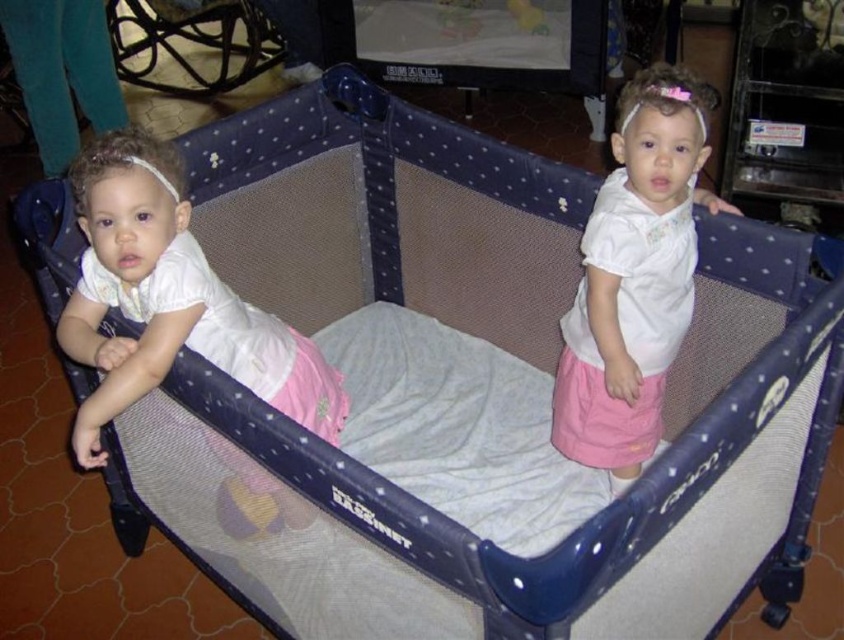
Question: Among these points, which one is farthest from the camera?

Choices:
 (A) (639, 102)
 (B) (122, 236)

Answer: (A)

Question: Does matte white dress at left appear under white matte shirt at upper center?

Choices:
 (A) yes
 (B) no

Answer: (A)

Question: Does matte white dress at left appear over white matte shirt at upper center?

Choices:
 (A) yes
 (B) no

Answer: (B)

Question: Does matte white dress at left appear under white matte shirt at upper center?

Choices:
 (A) yes
 (B) no

Answer: (A)

Question: Which of the following is the farthest from the observer?

Choices:
 (A) matte white dress at left
 (B) white matte shirt at upper center

Answer: (B)

Question: Which object is closer to the camera taking this photo?

Choices:
 (A) white matte shirt at upper center
 (B) matte white dress at left

Answer: (B)